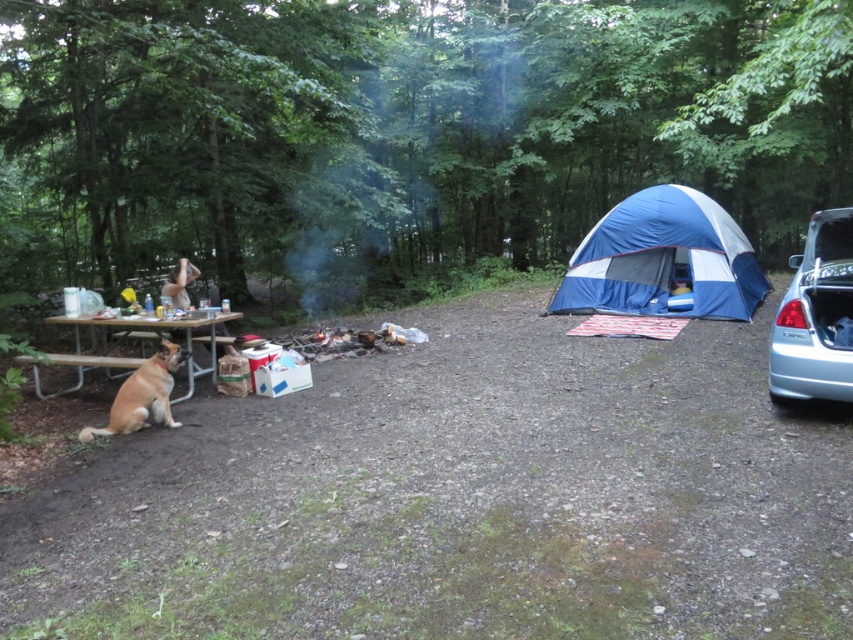
You are a camper who wants to place a 24 inch long backpack between the wooden picnic table at left and the brown fur dog at left. Is there enough space between them to fit the backpack?

The distance between the wooden picnic table at left and the brown fur dog at left is 30.90 inches. Since the backpack is 24 inches long, there is enough space to place it between them.